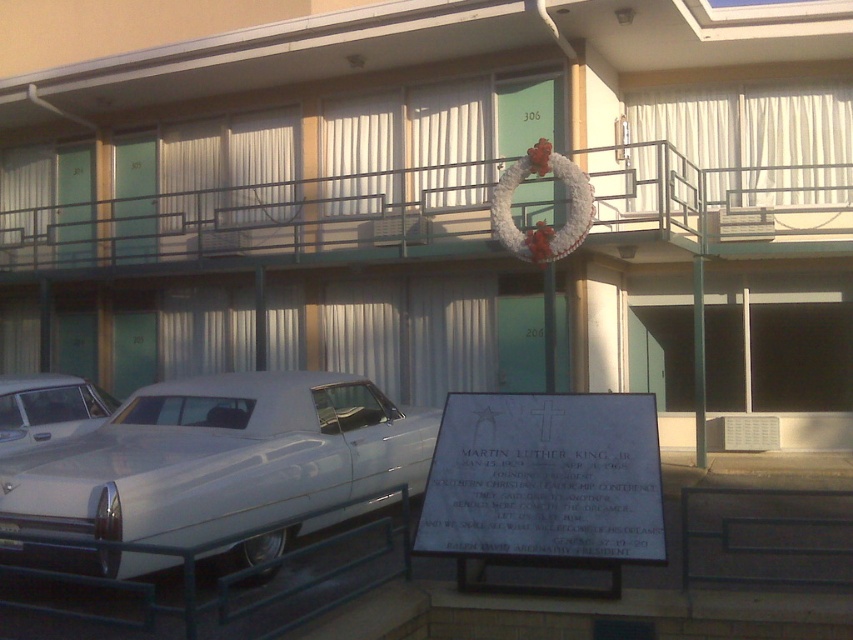
Is white stone plaque at center taller than white glossy sedan at lower left?

Yes.

Is white stone plaque at center wider than white glossy sedan at lower left?

Correct, the width of white stone plaque at center exceeds that of white glossy sedan at lower left.

This screenshot has width=853, height=640. What are the coordinates of `white stone plaque at center` in the screenshot? It's located at (544, 477).

Which is above, metallic green balcony at upper center or white glossy car at lower left?

metallic green balcony at upper center

You are a GUI agent. You are given a task and a screenshot of the screen. Output one action in this format:
    pyautogui.click(x=<x>, y=<y>)
    Task: Click on the metallic green balcony at upper center
    The height and width of the screenshot is (640, 853).
    Given the screenshot: What is the action you would take?
    pyautogui.click(x=262, y=220)

Is white glossy car at lower left further to the viewer compared to white stone plaque at center?

That is False.

Which is in front, point (354, 483) or point (618, 556)?

Point (618, 556)

Does point (172, 506) come in front of point (645, 474)?

No, (172, 506) is further to viewer.

At what (x,y) coordinates should I click in order to perform the action: click on white glossy car at lower left. Please return your answer as a coordinate pair (x, y). Looking at the image, I should click on (218, 458).